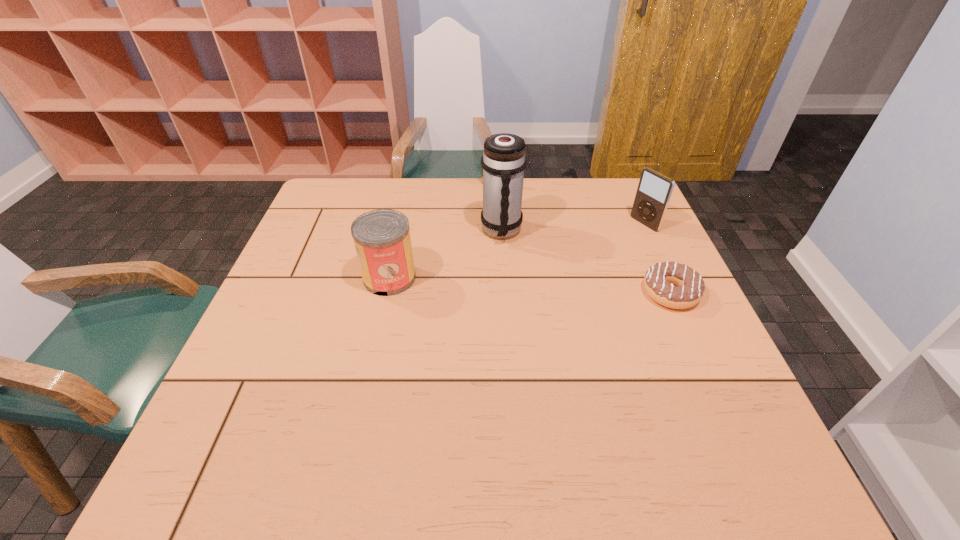
The height and width of the screenshot is (540, 960). In order to click on free space located 0.190m on the side with the handle of the tallest object in this screenshot , I will do `click(528, 293)`.

Find the location of a particular element. Image resolution: width=960 pixels, height=540 pixels. free space located on the front-facing side of the iPod is located at coordinates pyautogui.click(x=606, y=245).

You are a GUI agent. You are given a task and a screenshot of the screen. Output one action in this format:
    pyautogui.click(x=<x>, y=<y>)
    Task: Click on the vacant space located 0.310m on the front-facing side of the iPod
    
    Given the screenshot: What is the action you would take?
    pyautogui.click(x=558, y=271)

Find the location of `free spot located on the front-facing side of the iPod`. free spot located on the front-facing side of the iPod is located at coordinates (x=546, y=277).

Where is `free space located 0.080m on the side with the combination dials of the second shortest object`? free space located 0.080m on the side with the combination dials of the second shortest object is located at coordinates (505, 200).

Locate an element on the screen. Image resolution: width=960 pixels, height=540 pixels. vacant space located 0.370m on the side with the combination dials of the second shortest object is located at coordinates (540, 258).

Find the location of `vacant space located on the side with the combination dials of the second shortest object`. vacant space located on the side with the combination dials of the second shortest object is located at coordinates (532, 244).

At what (x,y) coordinates should I click in order to perform the action: click on thermos bottle located at the far edge. Please return your answer as a coordinate pair (x, y). The height and width of the screenshot is (540, 960). Looking at the image, I should click on (503, 161).

Where is `iPod that is at the far edge`? Image resolution: width=960 pixels, height=540 pixels. iPod that is at the far edge is located at coordinates (654, 191).

The height and width of the screenshot is (540, 960). Find the location of `padlock at the far edge`. padlock at the far edge is located at coordinates (482, 168).